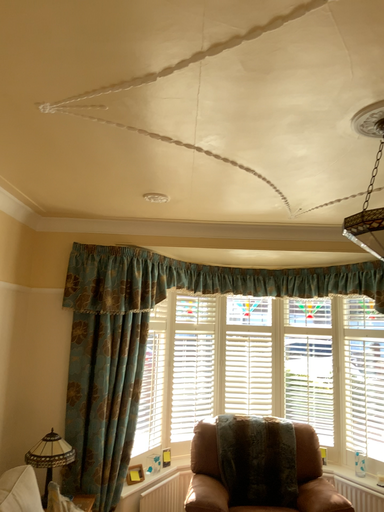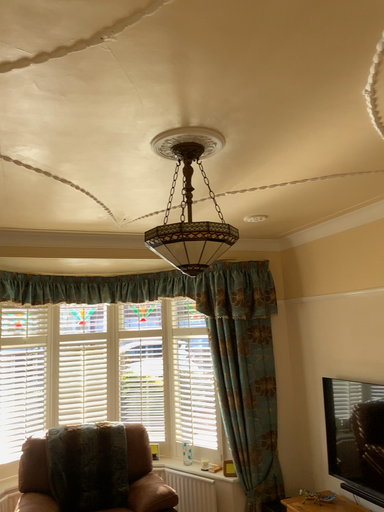
Question: How did the camera likely rotate when shooting the video?

Choices:
 (A) rotated left
 (B) rotated right

Answer: (B)